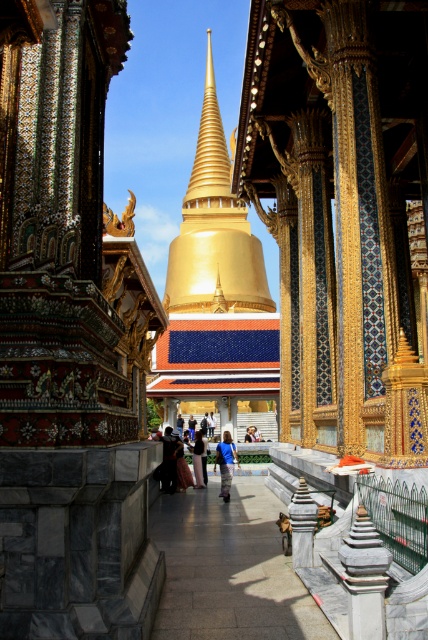
Find the location of a particular element. gold polished spire at center is located at coordinates (214, 230).

Is point (175, 275) positioned behind point (226, 429)?

Yes, point (175, 275) is behind point (226, 429).

Is point (196, 182) positioned before point (223, 442)?

That is False.

Image resolution: width=428 pixels, height=640 pixels. I want to click on gold polished spire at center, so click(214, 230).

Does black velvet dress at center appear on the left side of blue denim jeans at center?

Indeed, black velvet dress at center is positioned on the left side of blue denim jeans at center.

Which is more to the left, black velvet dress at center or blue denim jeans at center?

From the viewer's perspective, black velvet dress at center appears more on the left side.

Measure the distance between point (171, 445) and camera.

A distance of 61.96 meters exists between point (171, 445) and camera.

In order to click on black velvet dress at center in this screenshot , I will do `click(168, 460)`.

Between gold polished spire at center and blue denim jeans at center, which one has less height?

With less height is blue denim jeans at center.

Is gold polished spire at center taller than blue denim jeans at center?

Indeed, gold polished spire at center has a greater height compared to blue denim jeans at center.

Who is more forward, (253, 278) or (199, 444)?

Positioned in front is point (199, 444).

I want to click on gold polished spire at center, so point(214,230).